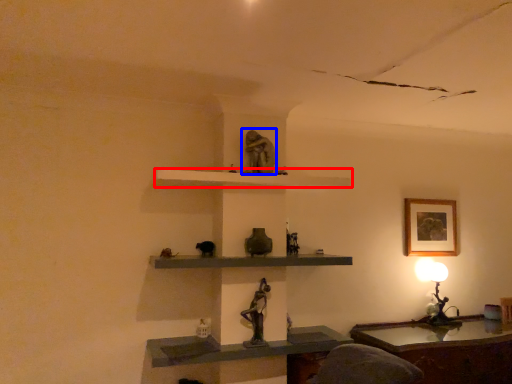
Question: Which object is further to the camera taking this photo, shelf (highlighted by a red box) or sculpture (highlighted by a blue box)?

Choices:
 (A) shelf
 (B) sculpture

Answer: (B)